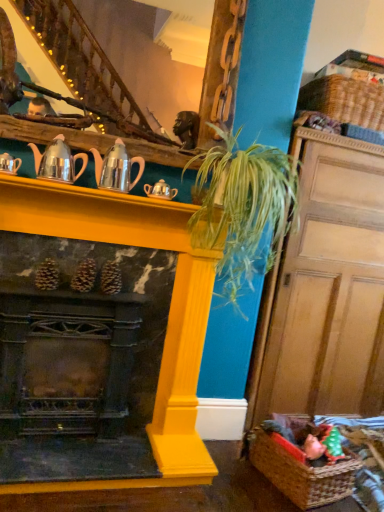
Question: From the image's perspective, is yellow painted wood fireplace at center located above metallic silver teapot at upper left, which ranks as the 4th tea pot in right-to-left order?

Choices:
 (A) no
 (B) yes

Answer: (A)

Question: Is yellow painted wood fireplace at center bigger than metallic silver teapot at upper left, acting as the 1th tea pot starting from the left?

Choices:
 (A) yes
 (B) no

Answer: (A)

Question: Can you confirm if yellow painted wood fireplace at center is positioned to the left of metallic silver teapot at upper left, which ranks as the 4th tea pot in right-to-left order?

Choices:
 (A) no
 (B) yes

Answer: (A)

Question: Is yellow painted wood fireplace at center completely or partially outside of metallic silver teapot at upper left, which ranks as the 4th tea pot in right-to-left order?

Choices:
 (A) no
 (B) yes

Answer: (B)

Question: Is yellow painted wood fireplace at center smaller than metallic silver teapot at upper left, acting as the 1th tea pot starting from the left?

Choices:
 (A) no
 (B) yes

Answer: (A)

Question: From the image's perspective, relative to yellow painted wood fireplace at center, is metallic silver teapot at upper left, which ranks as the 4th tea pot in right-to-left order, above or below?

Choices:
 (A) above
 (B) below

Answer: (A)

Question: Is point (4, 172) positioned closer to the camera than point (31, 231)?

Choices:
 (A) farther
 (B) closer

Answer: (B)

Question: Looking at the image, does metallic silver teapot at upper left, which ranks as the 4th tea pot in right-to-left order, seem bigger or smaller compared to yellow painted wood fireplace at center?

Choices:
 (A) big
 (B) small

Answer: (B)

Question: Visually, is metallic silver teapot at upper left, acting as the 1th tea pot starting from the left, positioned to the left or to the right of yellow painted wood fireplace at center?

Choices:
 (A) left
 (B) right

Answer: (A)

Question: Is point (347, 169) positioned closer to the camera than point (286, 155)?

Choices:
 (A) farther
 (B) closer

Answer: (A)

Question: Is wooden door at right inside or outside of green leafy plant at center?

Choices:
 (A) inside
 (B) outside

Answer: (B)

Question: In the image, is wooden door at right on the left side or the right side of green leafy plant at center?

Choices:
 (A) right
 (B) left

Answer: (A)

Question: Looking at the image, does wooden door at right seem bigger or smaller compared to green leafy plant at center?

Choices:
 (A) small
 (B) big

Answer: (B)

Question: Based on their positions, is yellow painted wood fireplace at center located to the left or right of wooden staircase at upper center?

Choices:
 (A) left
 (B) right

Answer: (A)

Question: From their relative heights in the image, would you say yellow painted wood fireplace at center is taller or shorter than wooden staircase at upper center?

Choices:
 (A) short
 (B) tall

Answer: (B)